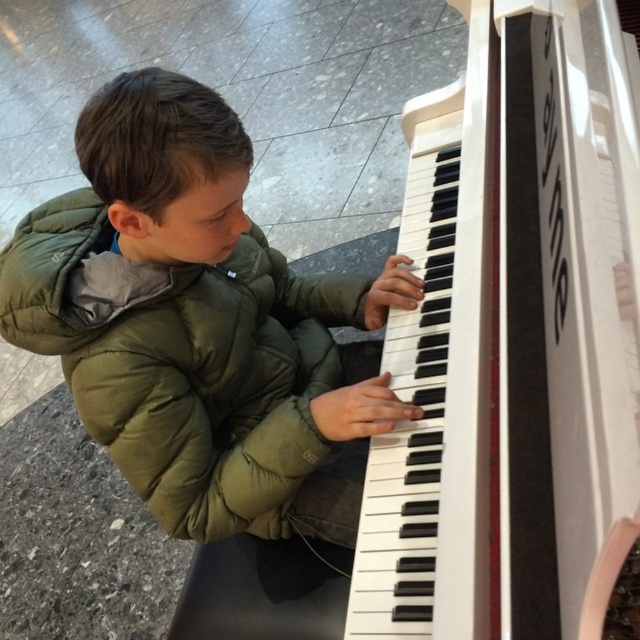
Is white glossy piano at center above green puffy jacket at center?

Yes, white glossy piano at center is above green puffy jacket at center.

Identify the location of white glossy piano at center. (513, 340).

At what (x,y) coordinates should I click in order to perform the action: click on white glossy piano at center. Please return your answer as a coordinate pair (x, y). Image resolution: width=640 pixels, height=640 pixels. Looking at the image, I should click on (513, 340).